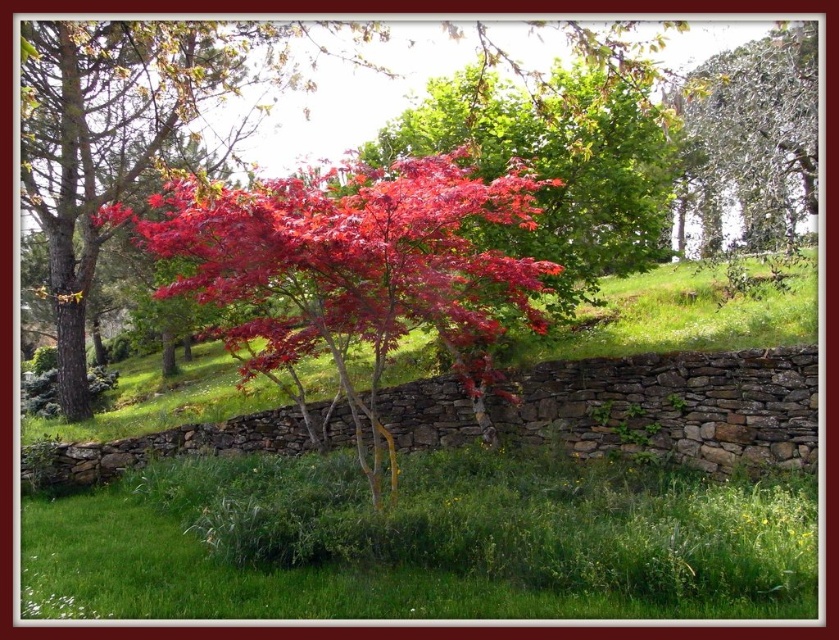
You are a gardener who needs to water the green leafy tree at upper right from the green grass at lower center. You have a hose that can reach 10 meters. Can you water the tree without moving the hose? Please explain your reasoning.

The distance between the green grass at lower center and the green leafy tree at upper right is 9.26 meters. Since the hose can reach 10 meters, which is longer than the required distance, you can water the tree without moving the hose.

You are standing in the middle of the outdoor scene and want to take a photo of both the glossy red maple tree at center and the green leafy tree at upper right. Which tree should you focus on first to ensure both are in sharp focus?

You should focus on the glossy red maple tree at center first because it is closer to you than the green leafy tree at upper right, so adjusting focus from near to far will help both be in sharp focus.

You are standing at the center of the image and want to locate the glossy red maple at center. What are the coordinates where you should look?

The glossy red maple at center is located at coordinates point (352,268).